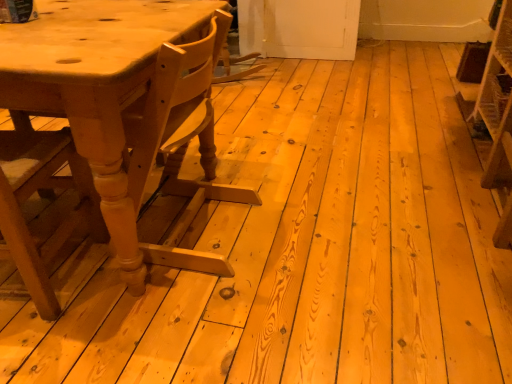
Find the location of a particular element. The width and height of the screenshot is (512, 384). free space that is in between light brown wood table at left and wooden crate at right is located at coordinates (351, 180).